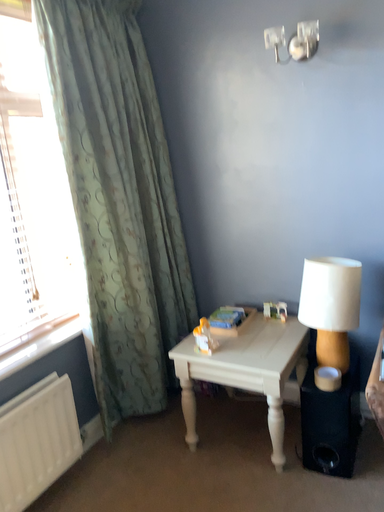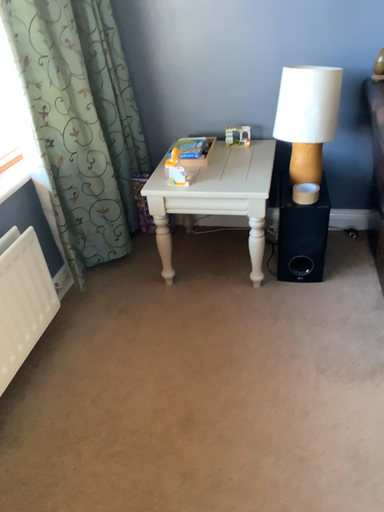
Question: Which way did the camera rotate in the video?

Choices:
 (A) rotated upward
 (B) rotated downward

Answer: (B)